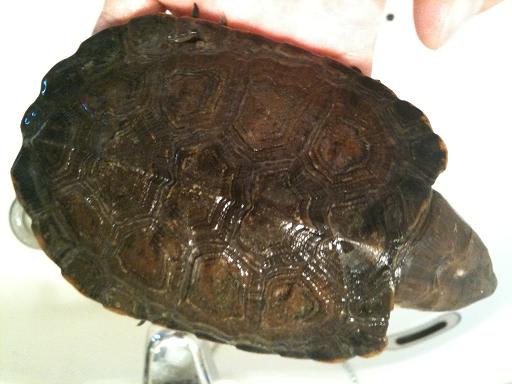
The width and height of the screenshot is (512, 384). Find the location of `empty space in sink bottom left of turtle`. empty space in sink bottom left of turtle is located at coordinates (32, 343).